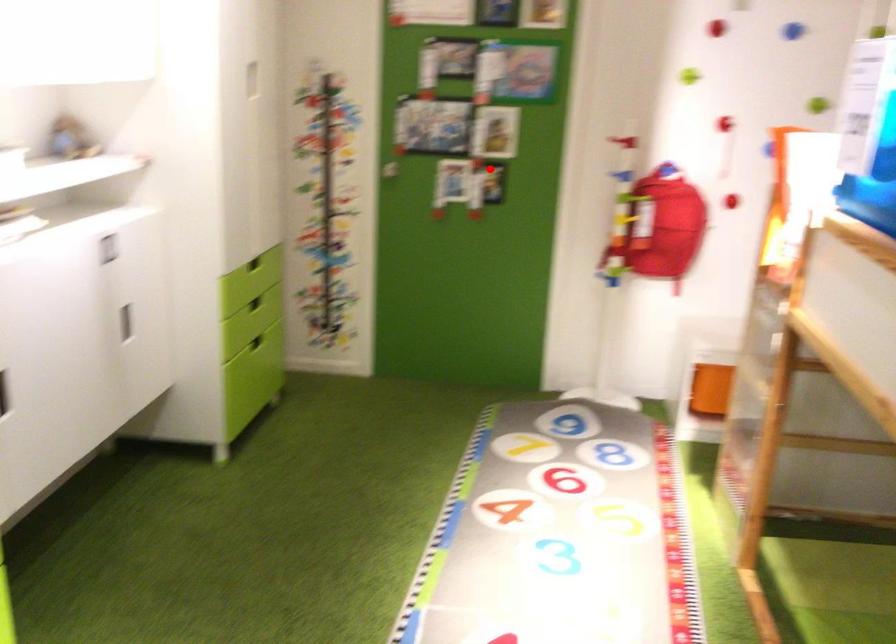
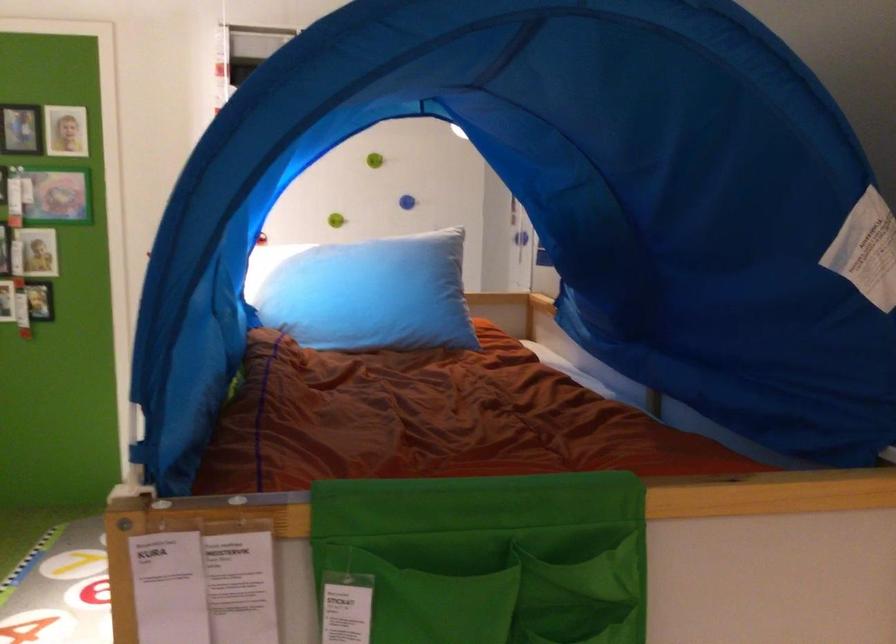
Locate, in the second image, the point that corresponds to the highlighted location in the first image.

(39, 301)